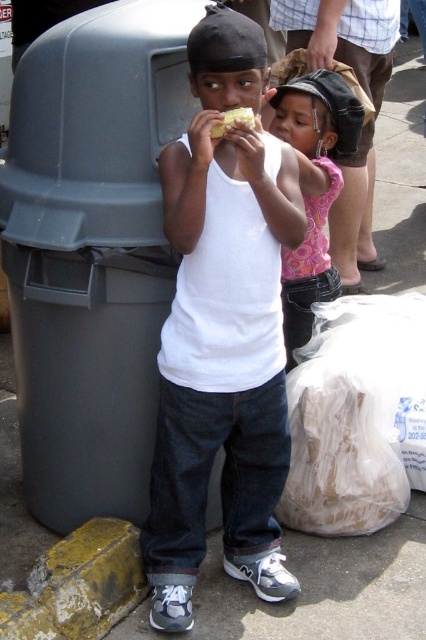
Question: Considering the real-world distances, which object is farthest from the gray plastic trash can at left?

Choices:
 (A) white matte tank top at center
 (B) pink fabric dress at upper center
 (C) yellow crumbly food at center

Answer: (C)

Question: Does gray plastic trash can at left appear on the left side of pink fabric dress at upper center?

Choices:
 (A) yes
 (B) no

Answer: (A)

Question: Does white matte tank top at center have a lesser width compared to pink fabric dress at upper center?

Choices:
 (A) no
 (B) yes

Answer: (A)

Question: Which point is farther to the camera?

Choices:
 (A) (88, 300)
 (B) (212, 125)
 (C) (281, 97)
 (D) (262, 278)

Answer: (C)

Question: Does white matte tank top at center have a smaller size compared to pink fabric dress at upper center?

Choices:
 (A) no
 (B) yes

Answer: (A)

Question: Which point is closer to the camera taking this photo?

Choices:
 (A) (307, 202)
 (B) (221, 131)

Answer: (B)